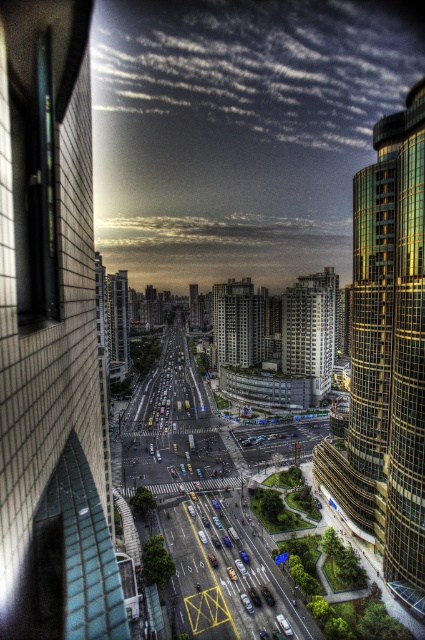
Question: Is the position of dark gray concrete building at center more distant than that of white concrete building at center?

Choices:
 (A) yes
 (B) no

Answer: (B)

Question: Does dark gray concrete building at center have a greater width compared to gold reflective glass building at center?

Choices:
 (A) no
 (B) yes

Answer: (B)

Question: Considering the relative positions of dark gray concrete building at center and gold reflective glass building at center in the image provided, where is dark gray concrete building at center located with respect to gold reflective glass building at center?

Choices:
 (A) above
 (B) below

Answer: (B)

Question: Estimate the real-world distances between objects in this image. Which object is farther from the gold reflective glass building at center?

Choices:
 (A) shiny glass skyscraper at right
 (B) brick wall at left
 (C) white concrete building at center

Answer: (B)

Question: Which object is positioned farthest from the white concrete building at center?

Choices:
 (A) brick wall at left
 (B) dark gray concrete building at center
 (C) shiny glass skyscraper at right

Answer: (A)

Question: Estimate the real-world distances between objects in this image. Which object is closer to the gold reflective glass building at center?

Choices:
 (A) brick wall at left
 (B) white concrete building at center

Answer: (B)